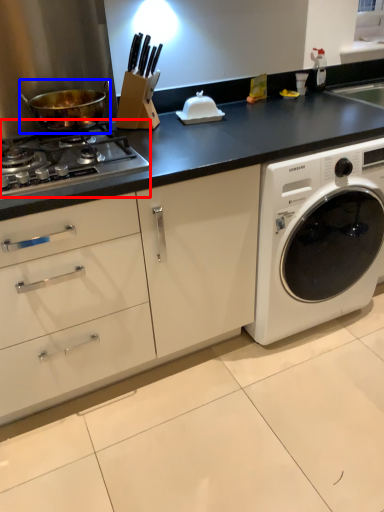
Question: Which object appears farthest to the camera in this image, gas stove (highlighted by a red box) or wok (highlighted by a blue box)?

Choices:
 (A) gas stove
 (B) wok

Answer: (B)